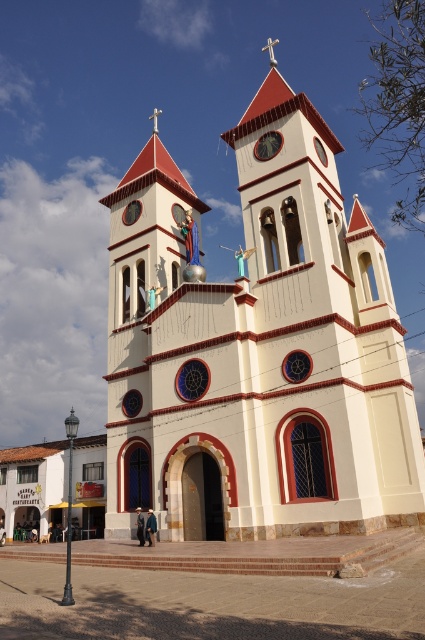
You are standing in front of the church and looking at two points marked on its facade. The first point is at coordinates point (150, 257) and the second is at point (274, 147). Which point is closer to you?

Point (150, 257) is further to the viewer than point (274, 147), so the point closer to you is point (274, 147).

You are a maintenance worker needing to reach both the white stucco church tower at center and the metallic clock at upper center for repairs. Given that your ladder can extend up to 14 meters, will you be able to safely reach both objects without moving the ladder?

The white stucco church tower at center and the metallic clock at upper center are 13.91 meters apart, so yes, the ladder can safely reach both objects since the distance between them is within the ladder extension limit of 14 meters.

You are standing in front of the church and want to take a photo that includes both the white stucco church tower at center and the metallic clock at upper center. Which object should you focus on first to ensure both are in the frame?

You should focus on the white stucco church tower at center first because it is larger than the metallic clock at upper center, so it will require more space in the frame.